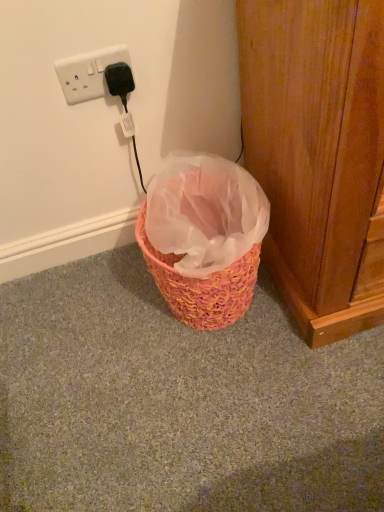
Question: Can wooden at right be found inside white plastic socket at upper left?

Choices:
 (A) yes
 (B) no

Answer: (B)

Question: Considering the relative positions of white plastic socket at upper left and wooden at right in the image provided, is white plastic socket at upper left behind wooden at right?

Choices:
 (A) yes
 (B) no

Answer: (A)

Question: From a real-world perspective, is white plastic socket at upper left below wooden at right?

Choices:
 (A) yes
 (B) no

Answer: (B)

Question: Does white plastic socket at upper left lie in front of wooden at right?

Choices:
 (A) yes
 (B) no

Answer: (B)

Question: Is white plastic socket at upper left positioned beyond the bounds of wooden at right?

Choices:
 (A) yes
 (B) no

Answer: (A)

Question: Can you confirm if white plastic socket at upper left is wider than wooden at right?

Choices:
 (A) yes
 (B) no

Answer: (B)

Question: Can you confirm if wooden at right is wider than white plastic socket at upper left?

Choices:
 (A) yes
 (B) no

Answer: (A)

Question: From the image's perspective, is wooden at right on top of white plastic socket at upper left?

Choices:
 (A) no
 (B) yes

Answer: (A)

Question: Is wooden at right positioned behind white plastic socket at upper left?

Choices:
 (A) no
 (B) yes

Answer: (A)

Question: Considering the relative positions of wooden at right and white plastic socket at upper left in the image provided, is wooden at right in front of white plastic socket at upper left?

Choices:
 (A) yes
 (B) no

Answer: (A)

Question: Considering the relative sizes of wooden at right and white plastic socket at upper left in the image provided, is wooden at right thinner than white plastic socket at upper left?

Choices:
 (A) yes
 (B) no

Answer: (B)

Question: Is wooden at right to the left of white plastic socket at upper left from the viewer's perspective?

Choices:
 (A) yes
 (B) no

Answer: (B)

Question: Considering their positions, is wooden at right located in front of or behind white plastic socket at upper left?

Choices:
 (A) behind
 (B) front

Answer: (B)